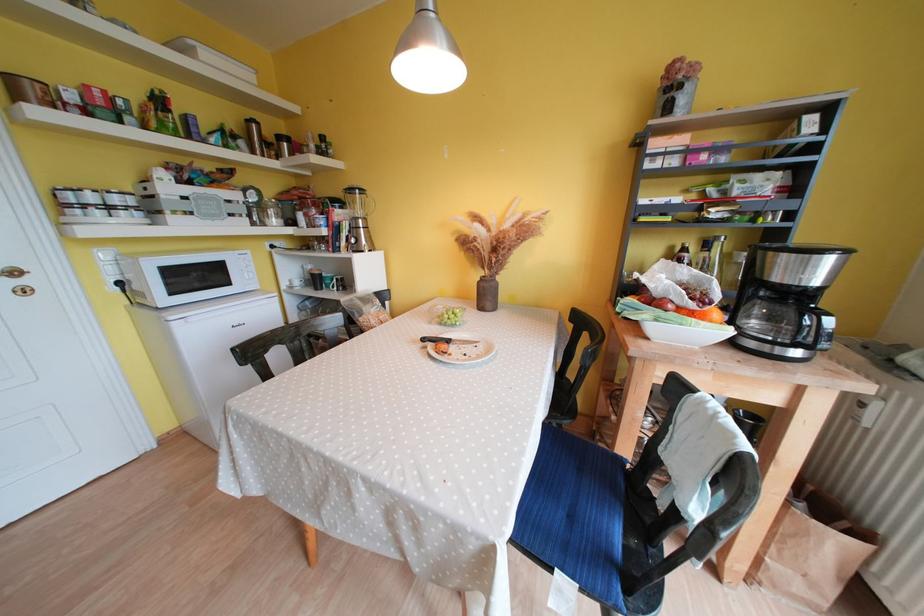
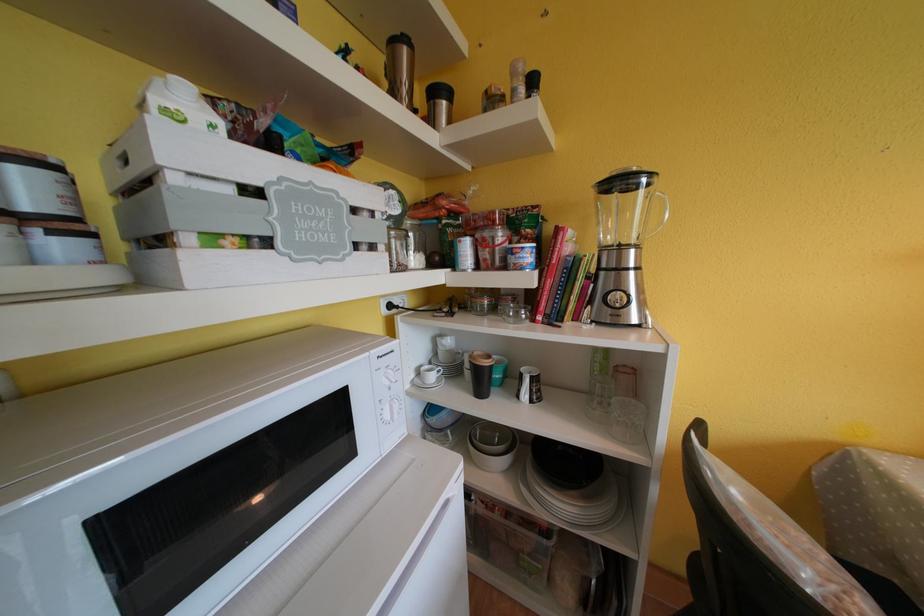
Find the pixel in the second image that matches point 342,292 in the first image.

(533, 400)